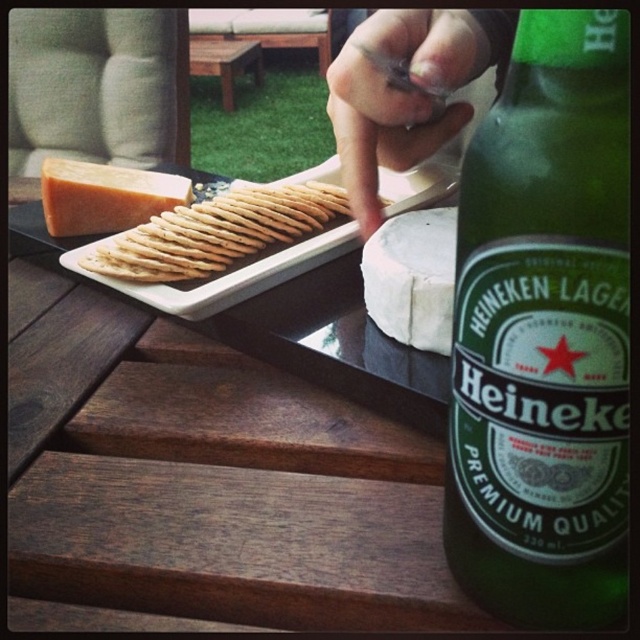
Does wooden table at center lie in front of smooth skin hand at upper center?

Yes.

Locate an element on the screen. wooden table at center is located at coordinates pyautogui.click(x=244, y=461).

Is smooth skin hand at upper center thinner than white creamy cheese at center?

In fact, smooth skin hand at upper center might be wider than white creamy cheese at center.

Can you confirm if smooth skin hand at upper center is positioned to the left of white creamy cheese at center?

No, smooth skin hand at upper center is not to the left of white creamy cheese at center.

What do you see at coordinates (406, 92) in the screenshot? I see `smooth skin hand at upper center` at bounding box center [406, 92].

Where is `smooth skin hand at upper center`? Image resolution: width=640 pixels, height=640 pixels. smooth skin hand at upper center is located at coordinates (406, 92).

Which is above, orange hard cheese at upper left or brown wooden picnic table at center?

brown wooden picnic table at center

Locate an element on the screen. Image resolution: width=640 pixels, height=640 pixels. orange hard cheese at upper left is located at coordinates (104, 196).